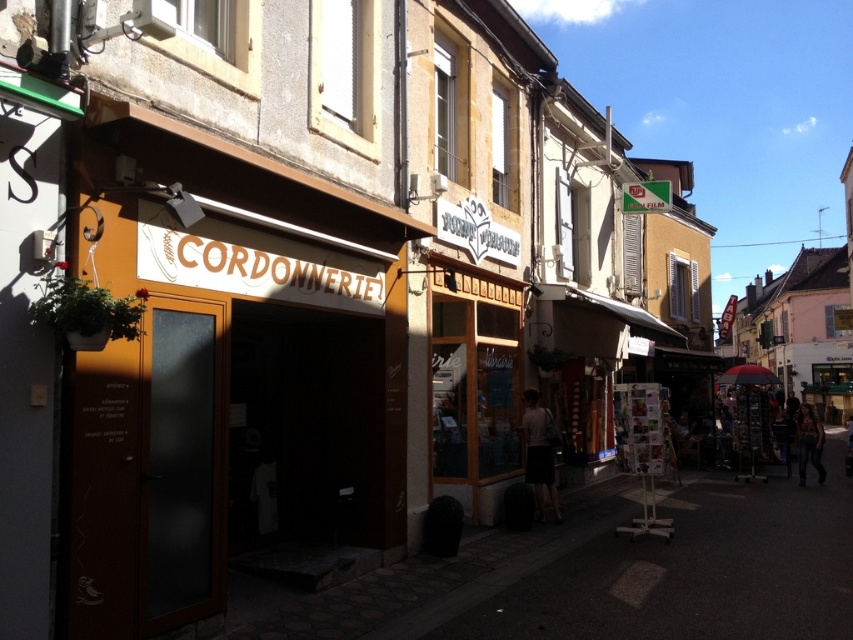
Between white cotton shirt at center and denim jeans at lower right, which one has less height?

Standing shorter between the two is white cotton shirt at center.

Where is `white cotton shirt at center`? Image resolution: width=853 pixels, height=640 pixels. white cotton shirt at center is located at coordinates (538, 452).

Who is more distant from viewer, (550, 467) or (814, 417)?

The point (814, 417) is more distant.

You are a GUI agent. You are given a task and a screenshot of the screen. Output one action in this format:
    pyautogui.click(x=<x>, y=<y>)
    Task: Click on the white cotton shirt at center
    The image size is (853, 640).
    Given the screenshot: What is the action you would take?
    pyautogui.click(x=538, y=452)

Who is more distant from viewer, (264, 401) or (550, 481)?

The point (550, 481) is behind.

In order to click on matte orange signboard at center in this screenshot , I will do `click(227, 372)`.

Between point (386, 372) and point (546, 451), which one is positioned in front?

Positioned in front is point (386, 372).

Where is `matte orange signboard at center`? Image resolution: width=853 pixels, height=640 pixels. matte orange signboard at center is located at coordinates (x=227, y=372).

Is matte orange signboard at center positioned at the back of denim jeans at lower right?

No, it is not.

Is matte orange signboard at center shorter than denim jeans at lower right?

No.

Describe the element at coordinates (227, 372) in the screenshot. The height and width of the screenshot is (640, 853). I see `matte orange signboard at center` at that location.

Image resolution: width=853 pixels, height=640 pixels. I want to click on matte orange signboard at center, so click(227, 372).